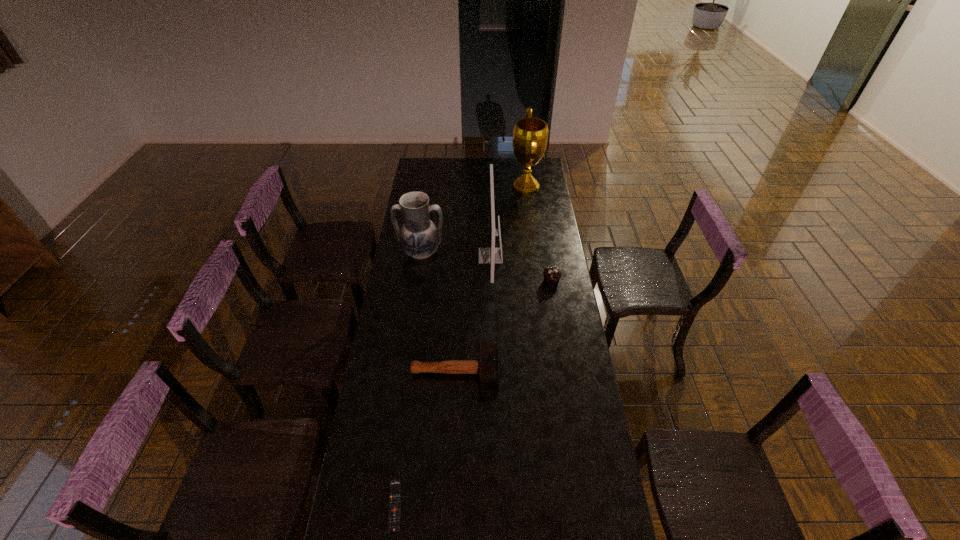
You are a GUI agent. You are given a task and a screenshot of the screen. Output one action in this format:
    pyautogui.click(x=<x>, y=<y>)
    Task: Click on the mallet present at the left edge
    Image resolution: width=960 pixels, height=540 pixels.
    Given the screenshot: What is the action you would take?
    [x=487, y=367]

This screenshot has height=540, width=960. What are the coordinates of `remote control situated at the left edge` in the screenshot? It's located at (394, 514).

The image size is (960, 540). Find the location of `award that is at the right edge`. award that is at the right edge is located at coordinates (530, 135).

Find the location of `cupcake that is at the right edge`. cupcake that is at the right edge is located at coordinates (552, 275).

Image resolution: width=960 pixels, height=540 pixels. In order to click on object that is at the far right corner in this screenshot , I will do `click(530, 135)`.

Locate an element on the screen. vacant space at the far edge is located at coordinates (515, 173).

You are a GUI agent. You are given a task and a screenshot of the screen. Output one action in this format:
    pyautogui.click(x=<x>, y=<y>)
    Task: Click on the free space at the left edge of the desktop
    The image size is (960, 540).
    Given the screenshot: What is the action you would take?
    pyautogui.click(x=361, y=429)

At what (x,y) coordinates should I click in order to perform the action: click on vacant space at the right edge of the desktop. Please return your answer as a coordinate pair (x, y). Looking at the image, I should click on (609, 516).

Identify the location of vacant point at the far right corner. (536, 166).

Locate an element on the screen. This screenshot has height=540, width=960. vacant space that's between the farthest object and the cupcake is located at coordinates (539, 233).